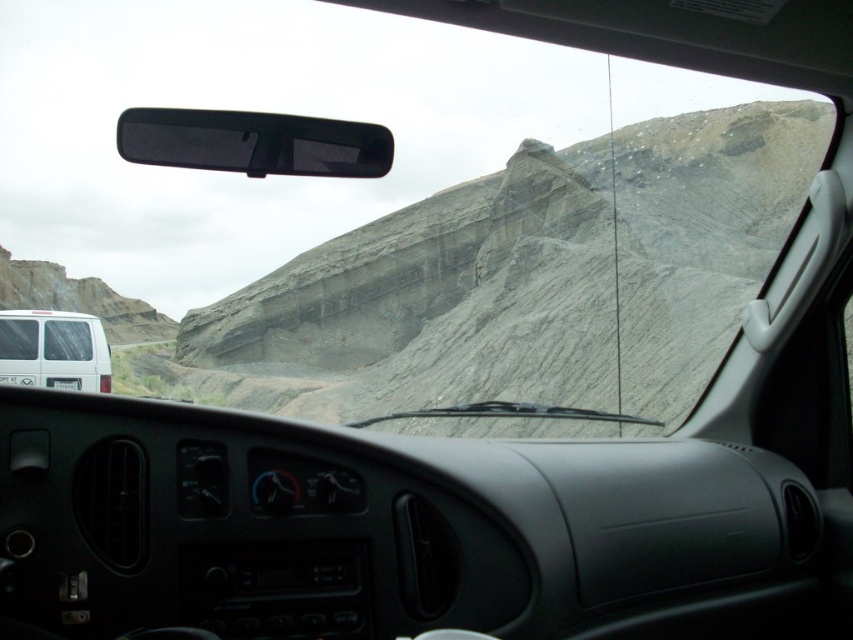
The image size is (853, 640). Find the location of `white matte van at left`. white matte van at left is located at coordinates (53, 349).

Consider the image. Between white matte van at left and clear glass windshield at left, which one is positioned lower?

clear glass windshield at left is below.

Is point (108, 387) closer to viewer compared to point (68, 337)?

That is False.

Find the location of a particular element. Image resolution: width=853 pixels, height=640 pixels. white matte van at left is located at coordinates (53, 349).

Can you confirm if gray rough rock at center is taller than white matte van at left?

Indeed, gray rough rock at center has a greater height compared to white matte van at left.

This screenshot has width=853, height=640. I want to click on gray rough rock at center, so click(527, 278).

Which is below, gray rough rock at center or clear glass windshield at left?

clear glass windshield at left is below.

Who is more forward, (711, 260) or (51, 353)?

Positioned in front is point (51, 353).

Locate an element on the screen. This screenshot has height=640, width=853. gray rough rock at center is located at coordinates (527, 278).